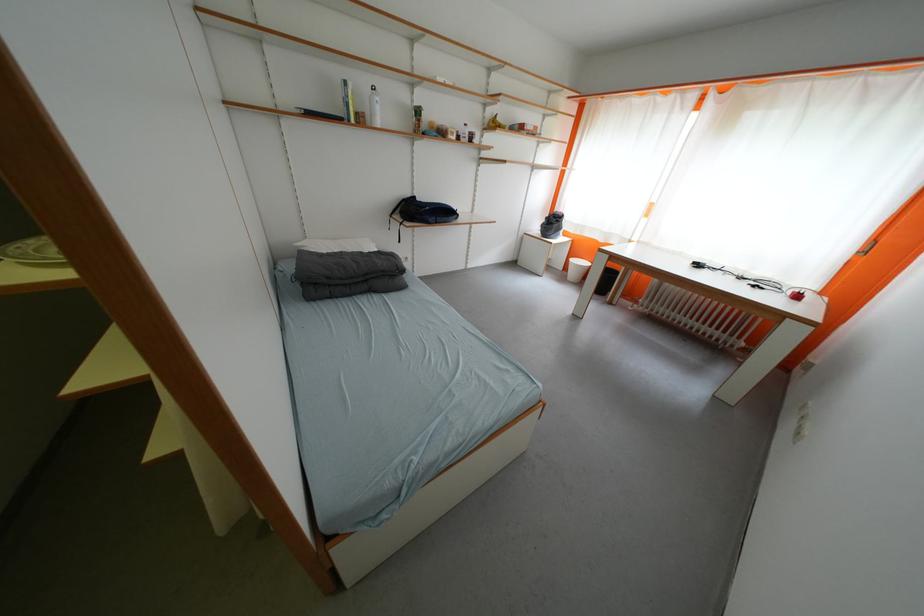
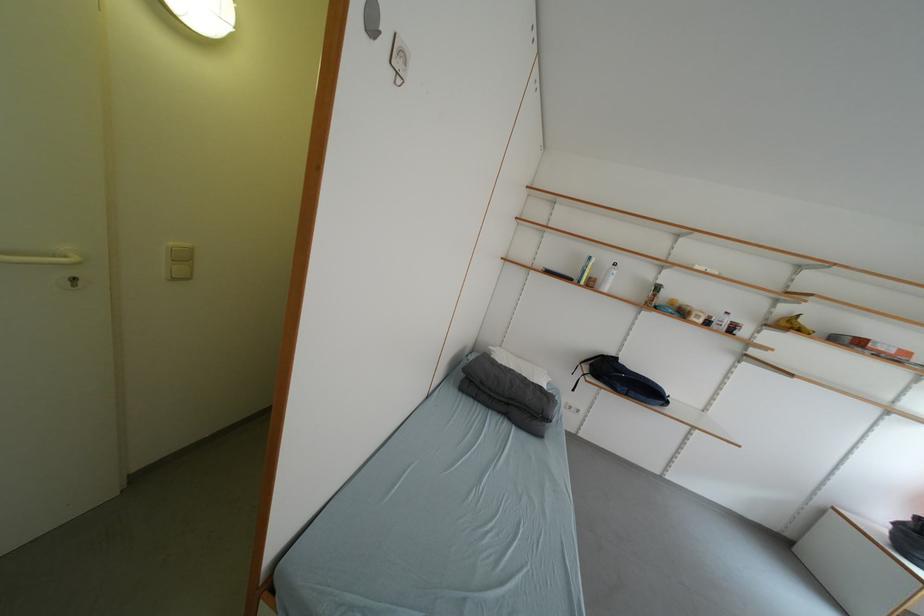
In the second image, find the point that corresponds to pixel 447 222 in the first image.

(640, 395)